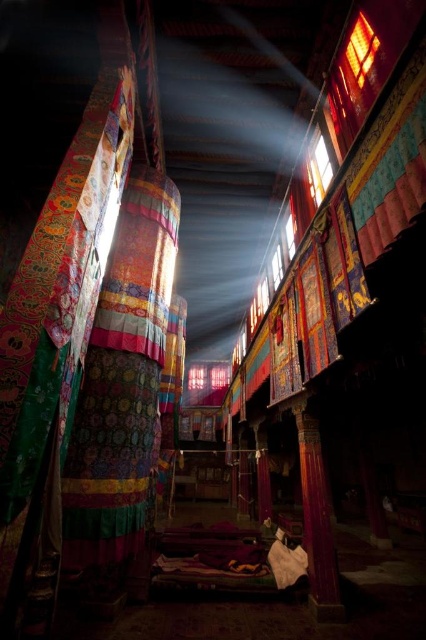
Question: Which object is farther from the camera taking this photo?

Choices:
 (A) purple fabric column at lower right
 (B) translucent glass window at upper center

Answer: (A)

Question: Which of the following is the closest to the observer?

Choices:
 (A) purple fabric column at lower right
 (B) translucent glass window at upper center

Answer: (B)

Question: Is purple fabric column at lower right smaller than translucent glass window at upper center?

Choices:
 (A) no
 (B) yes

Answer: (A)

Question: Observing the image, what is the correct spatial positioning of purple fabric column at lower right in reference to translucent glass window at upper center?

Choices:
 (A) above
 (B) below

Answer: (B)

Question: Where is purple fabric column at lower right located in relation to translucent glass window at upper center in the image?

Choices:
 (A) below
 (B) above

Answer: (A)